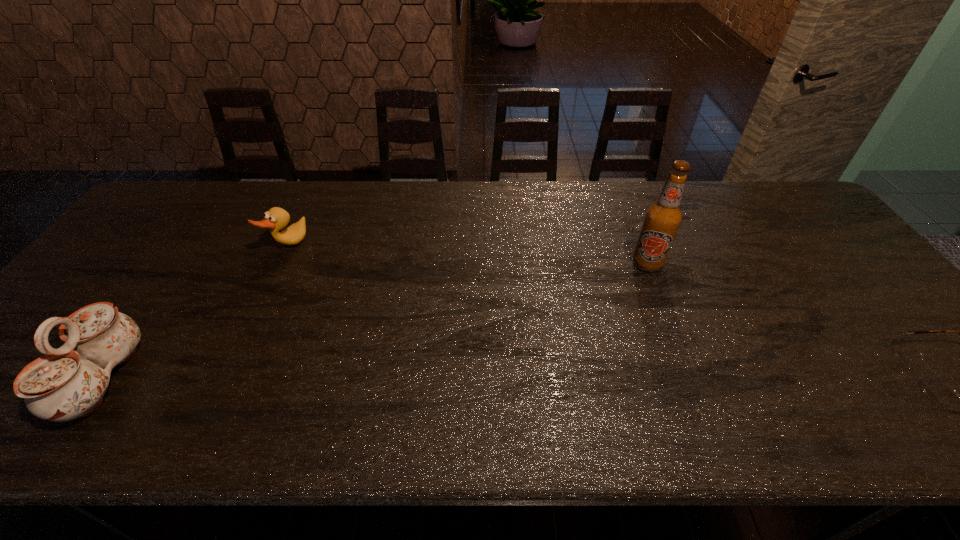
Where is `free region located 0.400m on the front label of the beer bottle`? free region located 0.400m on the front label of the beer bottle is located at coordinates (577, 377).

Locate an element on the screen. This screenshot has height=540, width=960. vacant region located 0.270m on the front label of the beer bottle is located at coordinates (601, 338).

What are the coordinates of `vacant region located on the front label of the beer bottle` in the screenshot? It's located at (613, 317).

You are a GUI agent. You are given a task and a screenshot of the screen. Output one action in this format:
    pyautogui.click(x=<x>, y=<y>)
    Task: Click on the object located in the near edge section of the desktop
    
    Given the screenshot: What is the action you would take?
    pos(66,383)

The height and width of the screenshot is (540, 960). I want to click on free space at the far edge of the desktop, so click(x=471, y=185).

This screenshot has width=960, height=540. In the image, there is a desktop. Identify the location of vacant space at the near edge. (852, 363).

You are a GUI agent. You are given a task and a screenshot of the screen. Output one action in this format:
    pyautogui.click(x=<x>, y=<y>)
    Task: Click on the unoccupied area between the leftmost object and the third tallest object
    This screenshot has width=960, height=540.
    Given the screenshot: What is the action you would take?
    [x=196, y=313]

This screenshot has width=960, height=540. I want to click on vacant area between the third object from right to left and the leftmost object, so click(x=196, y=313).

This screenshot has height=540, width=960. Find the location of `vacant space in between the chinaware and the beer bottle`. vacant space in between the chinaware and the beer bottle is located at coordinates (375, 321).

You are a GUI agent. You are given a task and a screenshot of the screen. Output one action in this format:
    pyautogui.click(x=<x>, y=<y>)
    Task: Click on the vacant space in between the chinaware and the third object from right to left
    This screenshot has height=540, width=960.
    Given the screenshot: What is the action you would take?
    pyautogui.click(x=196, y=313)